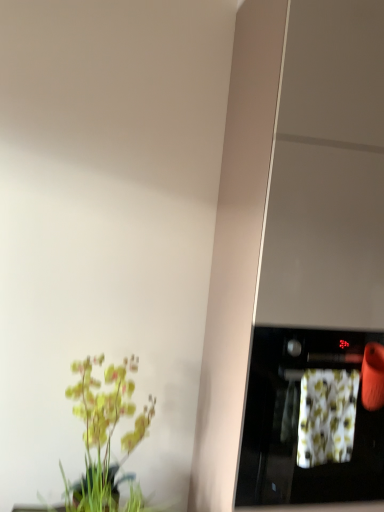
Question: Considering the relative positions of floral fabric at right and black glossy oven at right in the image provided, is floral fabric at right to the right of black glossy oven at right from the viewer's perspective?

Choices:
 (A) yes
 (B) no

Answer: (A)

Question: Is the position of floral fabric at right less distant than that of black glossy oven at right?

Choices:
 (A) yes
 (B) no

Answer: (B)

Question: Is floral fabric at right positioned with its back to black glossy oven at right?

Choices:
 (A) no
 (B) yes

Answer: (B)

Question: Can you confirm if floral fabric at right is thinner than black glossy oven at right?

Choices:
 (A) no
 (B) yes

Answer: (B)

Question: From the image's perspective, is floral fabric at right under black glossy oven at right?

Choices:
 (A) yes
 (B) no

Answer: (B)

Question: In terms of width, does floral fabric at right look wider or thinner when compared to green matte plant at lower left?

Choices:
 (A) thin
 (B) wide

Answer: (A)

Question: Considering the positions of point (327, 394) and point (152, 412), is point (327, 394) closer or farther from the camera than point (152, 412)?

Choices:
 (A) farther
 (B) closer

Answer: (B)

Question: In the image, is floral fabric at right on the left side or the right side of green matte plant at lower left?

Choices:
 (A) right
 (B) left

Answer: (A)

Question: Is floral fabric at right situated inside green matte plant at lower left or outside?

Choices:
 (A) outside
 (B) inside

Answer: (A)

Question: Is green matte plant at lower left bigger or smaller than floral fabric at right?

Choices:
 (A) big
 (B) small

Answer: (A)

Question: Is green matte plant at lower left inside the boundaries of floral fabric at right, or outside?

Choices:
 (A) inside
 (B) outside

Answer: (B)

Question: From their relative heights in the image, would you say green matte plant at lower left is taller or shorter than floral fabric at right?

Choices:
 (A) tall
 (B) short

Answer: (A)

Question: Is point (112, 378) positioned closer to the camera than point (311, 436)?

Choices:
 (A) farther
 (B) closer

Answer: (A)

Question: Is floral fabric at right situated inside black glossy oven at right or outside?

Choices:
 (A) inside
 (B) outside

Answer: (A)

Question: In the image, is floral fabric at right on the left side or the right side of black glossy oven at right?

Choices:
 (A) right
 (B) left

Answer: (A)